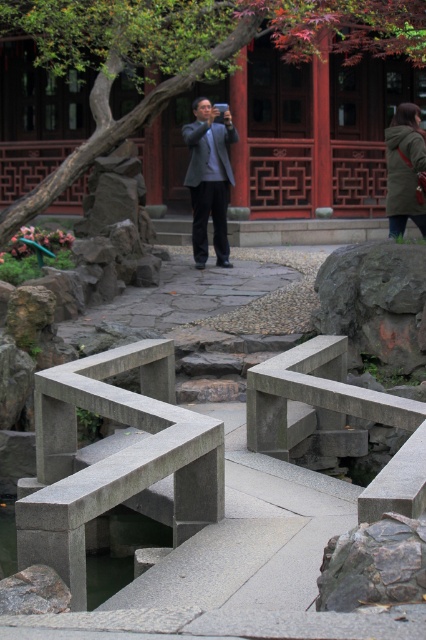
Does smooth gray stone pond at center lie in front of dark green textured coat at center?

Yes, it is.

Does point (0, 524) lie in front of point (406, 124)?

That is True.

Locate an element on the screen. The width and height of the screenshot is (426, 640). smooth gray stone pond at center is located at coordinates (121, 554).

Identify the location of green leafy tree at upper center. Image resolution: width=426 pixels, height=640 pixels. (184, 52).

Does matte gray suit at center appear under dark green textured coat at center?

No.

Does matte gray suit at center have a greater height compared to dark green textured coat at center?

Indeed, matte gray suit at center has a greater height compared to dark green textured coat at center.

Is point (190, 145) farther from camera compared to point (394, 125)?

That is True.

The height and width of the screenshot is (640, 426). Identify the location of matte gray suit at center. (209, 179).